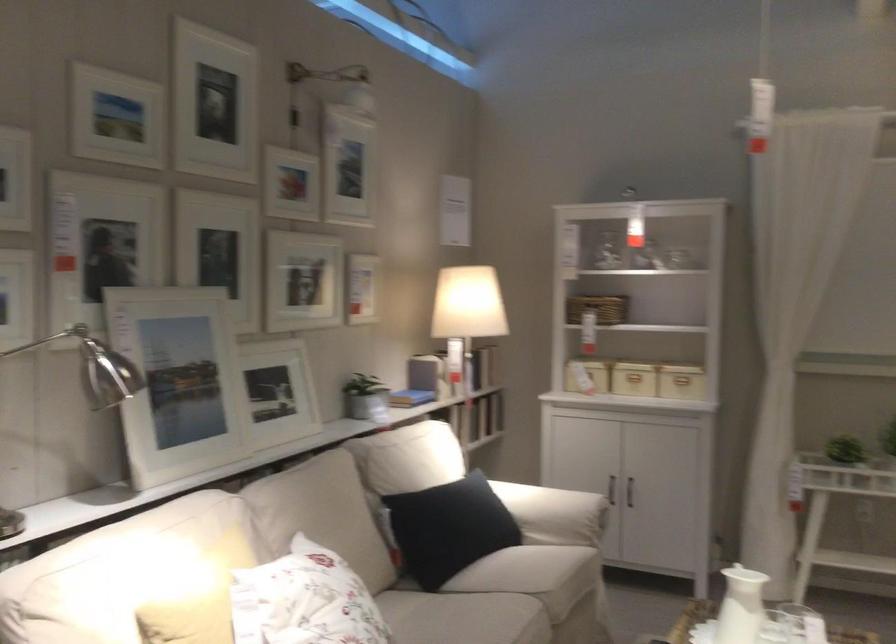
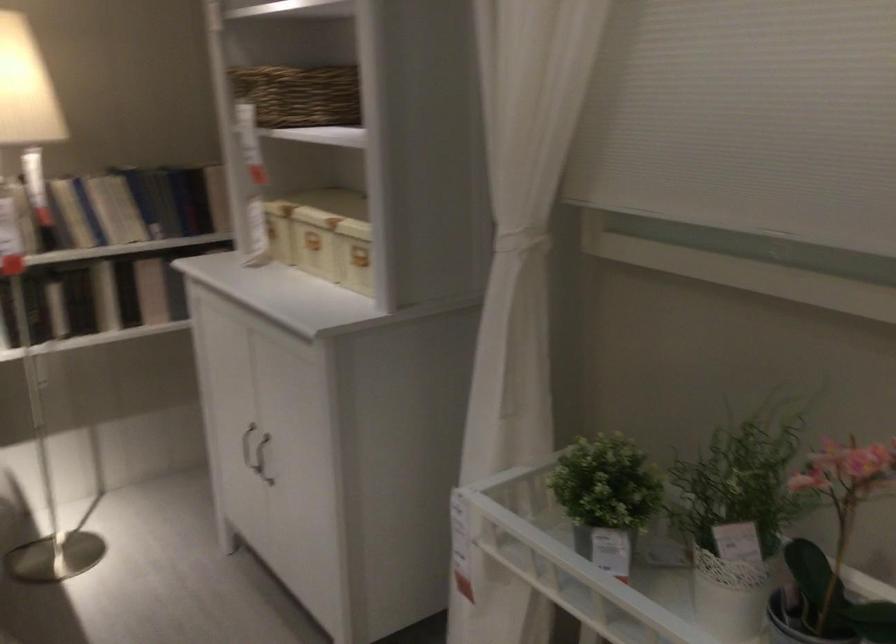
Where in the second image is the point corresponding to point 468,421 from the first image?

(105, 296)